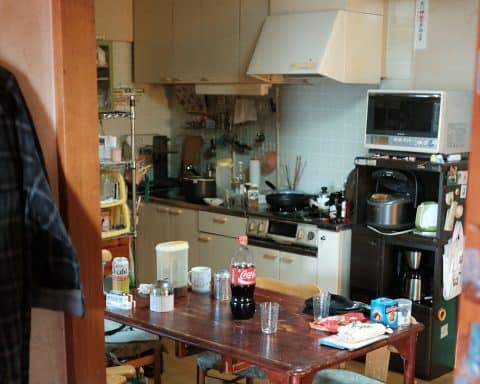
Identify the location of pot. Image resolution: width=480 pixels, height=384 pixels. (209, 185).